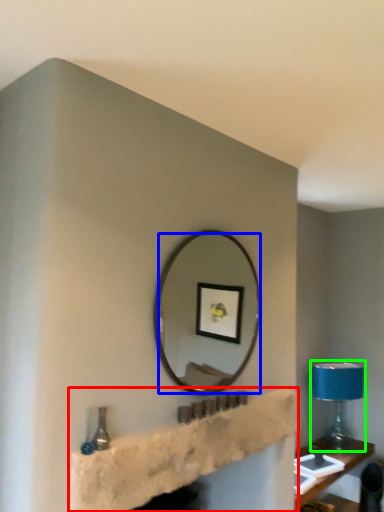
Question: Estimate the real-world distances between objects in this image. Which object is farther from shelf (highlighted by a red box), mirror (highlighted by a blue box) or table lamp (highlighted by a green box)?

Choices:
 (A) mirror
 (B) table lamp

Answer: (A)